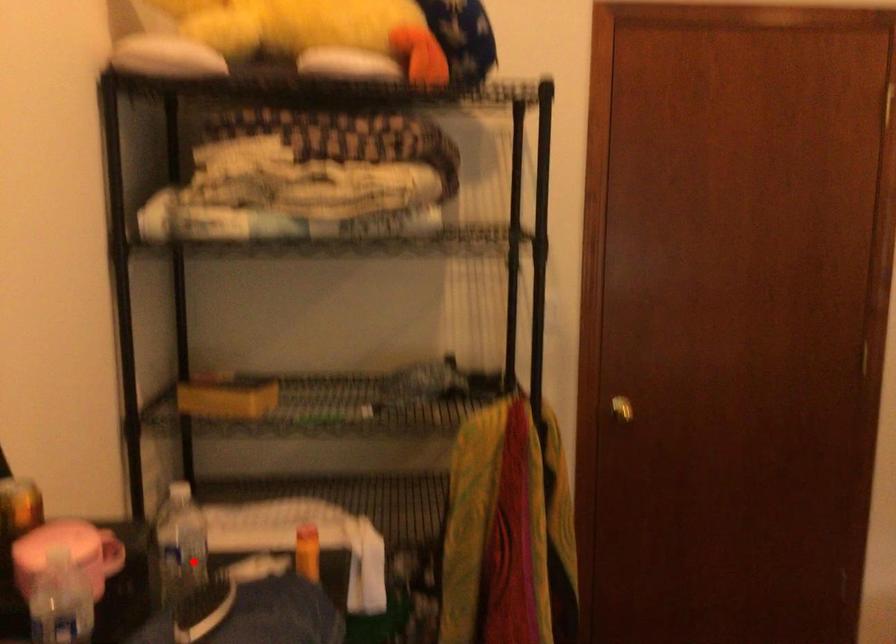
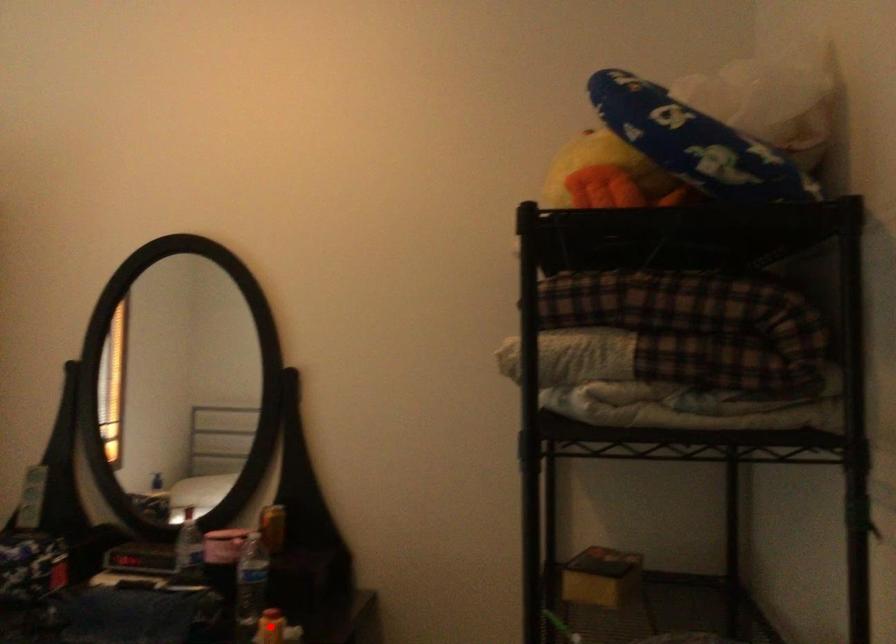
I am providing you with two images of the same scene from different viewpoints. A red point is marked on the first image and another point is marked on the second image. Does the point marked in image1 correspond to the same location as the one in image2?

No